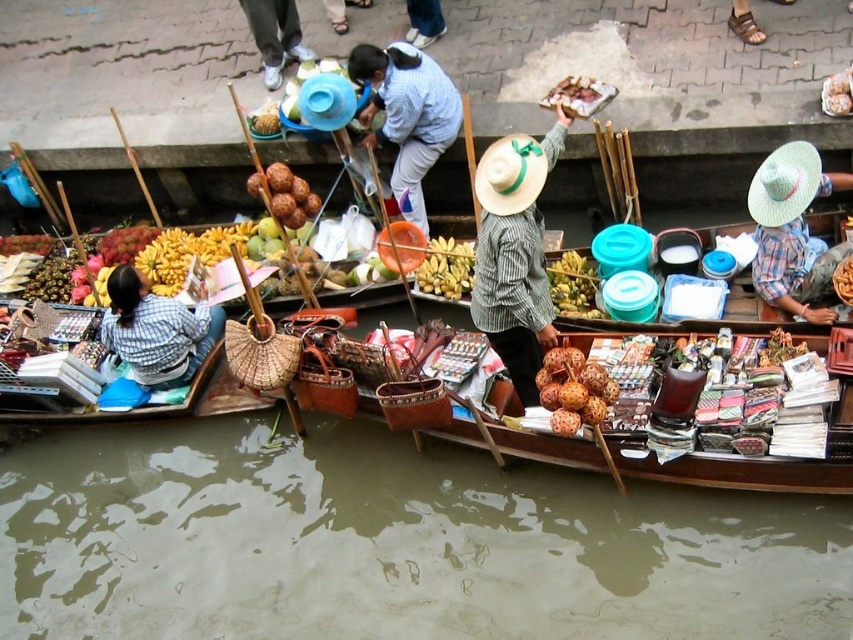
You are a vendor at the floating market who needs to place a large basket of fresh vegetables on your boat. The basket is too heavy to lift, so you decide to slide it across the boat deck. There are two spots available for sliding it to the brown murky water at lower center and the smooth brown nuts at center. Which spot will require more effort due to the surface texture?

The smooth brown nuts at center have a smoother surface compared to the brown murky water at lower center. Sliding the basket over the smooth brown nuts at center would require less effort, so the brown murky water at lower center would need more effort due to its rougher surface.

You are standing at the edge of the floating market and want to take a photo of the point at coordinate [355,605]. Your camera has a maximum focus range of 20 feet. Will the camera be able to focus on the point?

The point at coordinate [355,605] is 22.25 feet away from the camera, which exceeds the maximum focus range of 20 feet. Therefore, the camera will not be able to focus on the point.

You are a vendor at the floating market and need to place a new item between the plaid fabric hat at right and the smooth brown nuts at center. Which item should you place closer to the center to ensure it fits better?

Since the plaid fabric hat at right is wider than the smooth brown nuts at center, you should place the new item closer to the smooth brown nuts at center to ensure it fits better in the available space.